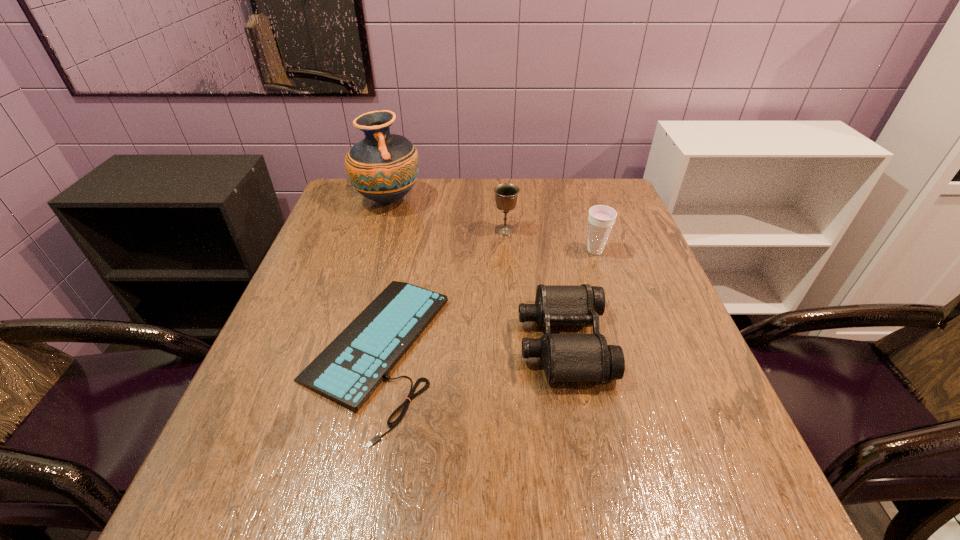
This screenshot has width=960, height=540. In the image, there is a desktop. What are the coordinates of `free space at the near edge` in the screenshot? It's located at (461, 483).

The height and width of the screenshot is (540, 960). Find the location of `vacant space at the left edge of the desktop`. vacant space at the left edge of the desktop is located at coordinates (232, 434).

Locate an element on the screen. This screenshot has height=540, width=960. free spot at the right edge of the desktop is located at coordinates (680, 377).

Where is `free space at the far left corner of the desktop`? The height and width of the screenshot is (540, 960). free space at the far left corner of the desktop is located at coordinates (374, 218).

Locate an element on the screen. The height and width of the screenshot is (540, 960). free space at the near left corner of the desktop is located at coordinates (224, 521).

In the image, there is a desktop. What are the coordinates of `vacant space at the far right corner` in the screenshot? It's located at (610, 181).

You are a GUI agent. You are given a task and a screenshot of the screen. Output one action in this format:
    pyautogui.click(x=<x>, y=<y>)
    Task: Click on the vacant area that lies between the shortest object and the second farthest object
    This screenshot has width=960, height=540.
    Given the screenshot: What is the action you would take?
    pyautogui.click(x=440, y=290)

At what (x,y) coordinates should I click in order to perform the action: click on vacant space that is in between the pottery and the fourth tallest object. Please return your answer as a coordinate pair (x, y). Image resolution: width=960 pixels, height=540 pixels. Looking at the image, I should click on (476, 271).

I want to click on empty location between the third farthest object and the pottery, so click(x=492, y=226).

Where is `free space between the shortest object and the tallest object`? free space between the shortest object and the tallest object is located at coordinates (381, 275).